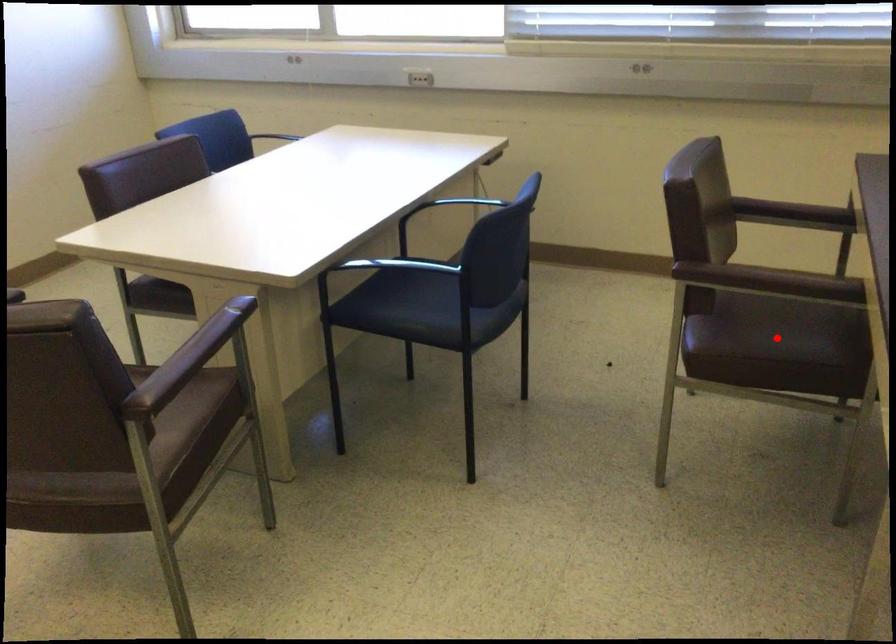
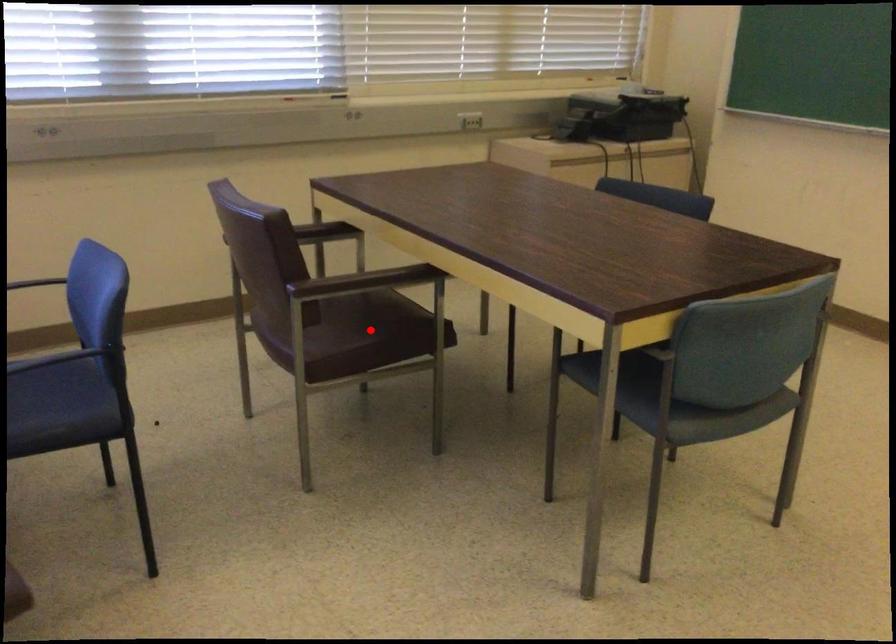
I am providing you with two images of the same scene from different viewpoints. A red point is marked on the first image and another point is marked on the second image. Is the marked point in image1 the same physical position as the marked point in image2?

Yes